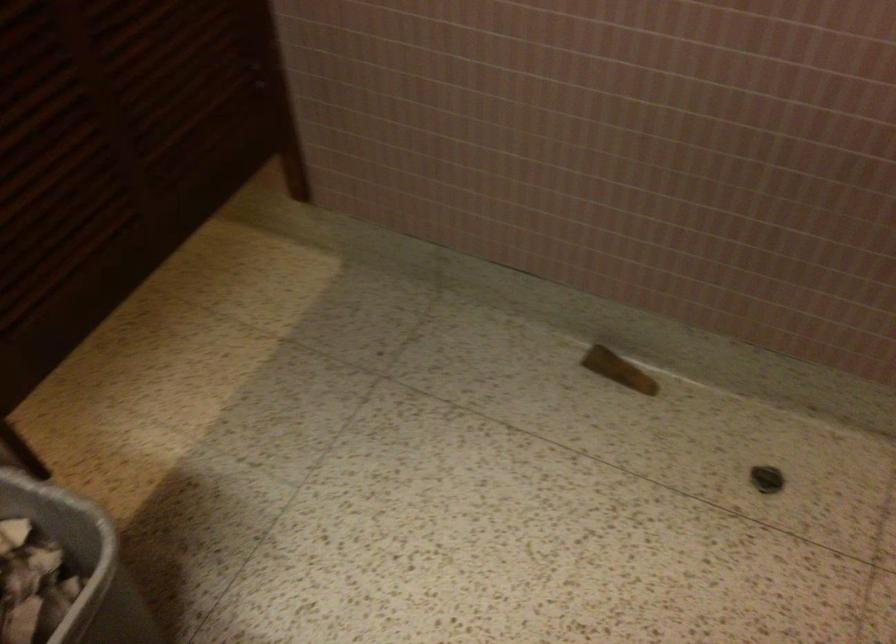
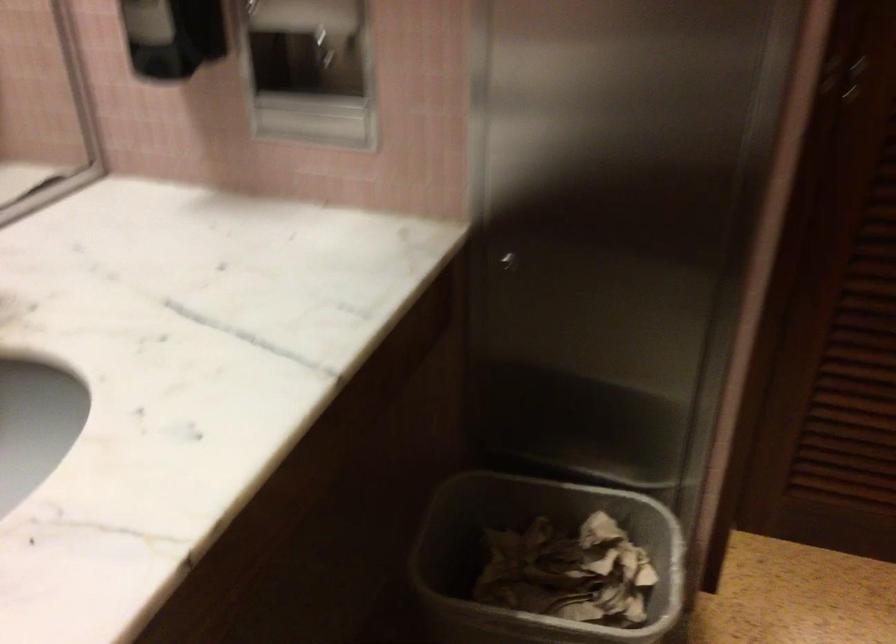
In the scene shown: How did the camera likely rotate?

The rotation direction of the camera is left-down.